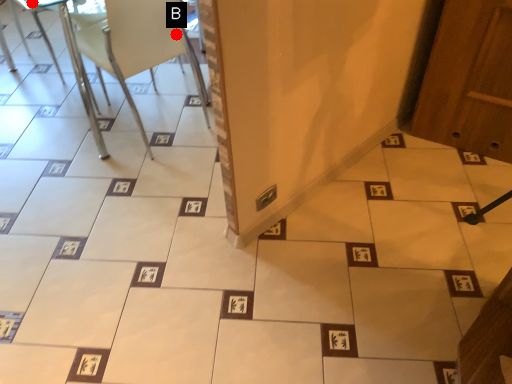
Question: Two points are circled on the image, labeled by A and B beside each circle. Which point appears farthest from the camera in this image?

Choices:
 (A) A is further
 (B) B is further

Answer: (A)